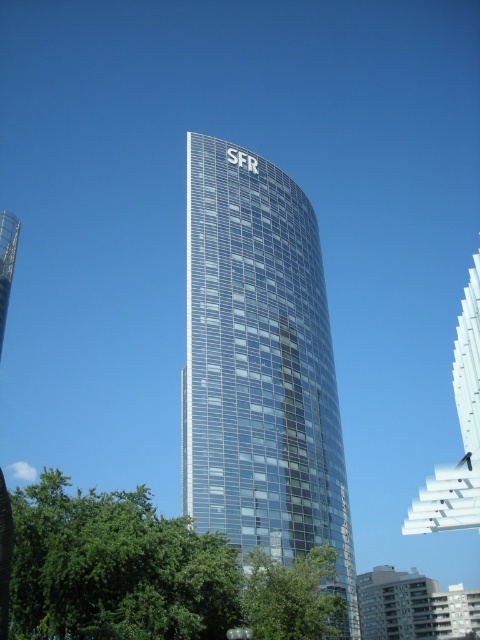
Between green leafy tree at lower left and green leafy tree at lower center, which one is positioned higher?

green leafy tree at lower center is higher up.

Can you confirm if green leafy tree at lower left is shorter than green leafy tree at lower center?

In fact, green leafy tree at lower left may be taller than green leafy tree at lower center.

Is point (224, 616) behind point (297, 608)?

No, it is in front of (297, 608).

The height and width of the screenshot is (640, 480). I want to click on green leafy tree at lower left, so click(x=149, y=573).

Which is in front, point (259, 488) or point (191, 628)?

Point (191, 628)

Is transparent glass tower at center below green leafy tree at lower left?

Incorrect, transparent glass tower at center is not positioned below green leafy tree at lower left.

Measure the distance between transparent glass tower at center and camera.

transparent glass tower at center is 151.86 feet away from camera.

The height and width of the screenshot is (640, 480). What are the coordinates of `transparent glass tower at center` in the screenshot? It's located at (261, 369).

Can you confirm if transparent glass tower at center is wider than green leafy tree at lower center?

Correct, the width of transparent glass tower at center exceeds that of green leafy tree at lower center.

The image size is (480, 640). Find the location of `transparent glass tower at center`. transparent glass tower at center is located at coordinates (261, 369).